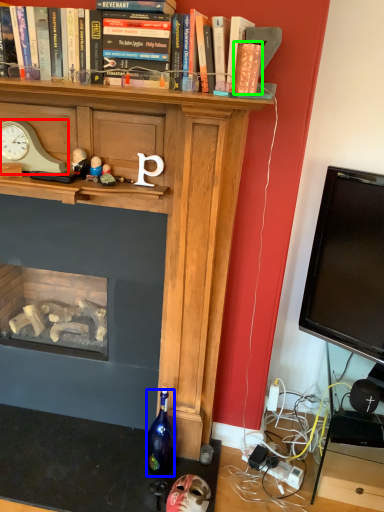
Question: Which is farther away from clock (highlighted by a red box)? bottle (highlighted by a blue box) or paperback book (highlighted by a green box)?

Choices:
 (A) bottle
 (B) paperback book

Answer: (A)